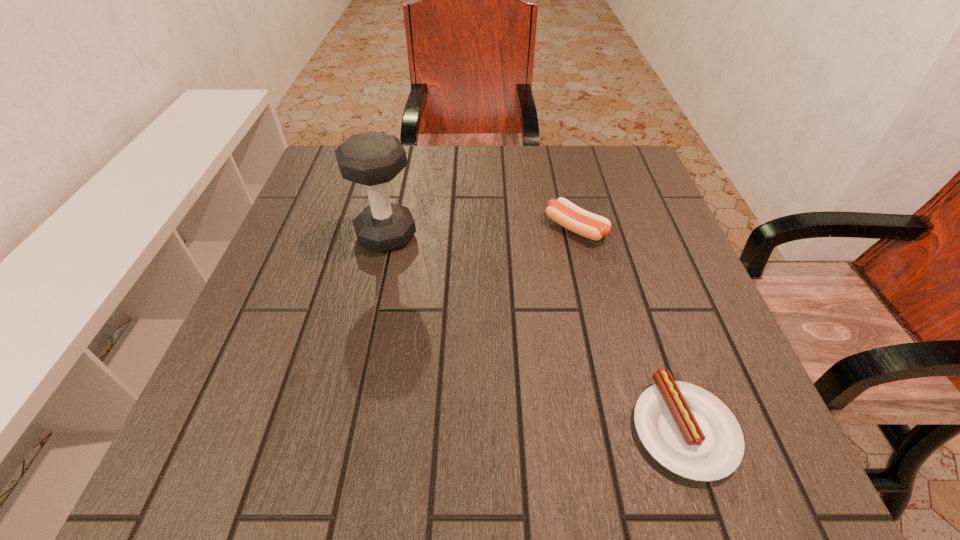
This screenshot has height=540, width=960. In order to click on object at the left edge in this screenshot , I will do `click(373, 158)`.

What are the coordinates of `object present at the near right corner` in the screenshot? It's located at (688, 430).

Identify the location of vacant position at the far edge of the desktop. This screenshot has height=540, width=960. (536, 179).

Locate an element on the screen. The width and height of the screenshot is (960, 540). vacant space at the near edge is located at coordinates (637, 457).

The height and width of the screenshot is (540, 960). In the image, there is a desktop. What are the coordinates of `free space at the left edge` in the screenshot? It's located at (279, 280).

Where is `vacant area at the right edge`? Image resolution: width=960 pixels, height=540 pixels. vacant area at the right edge is located at coordinates (680, 241).

You are a GUI agent. You are given a task and a screenshot of the screen. Output one action in this format:
    pyautogui.click(x=<x>, y=<y>)
    Task: Click on the free region at the far left corner of the desktop
    The image size is (960, 540).
    Given the screenshot: What is the action you would take?
    pyautogui.click(x=320, y=195)

Where is `free region at the near right corner of the desktop`? The height and width of the screenshot is (540, 960). free region at the near right corner of the desktop is located at coordinates click(x=782, y=485).

Where is `unoccupied position between the nearer sausage and the farther sausage`? unoccupied position between the nearer sausage and the farther sausage is located at coordinates (630, 328).

Find the location of a particular element. Image resolution: width=960 pixels, height=540 pixels. free space between the second shortest object and the nearer sausage is located at coordinates (630, 328).